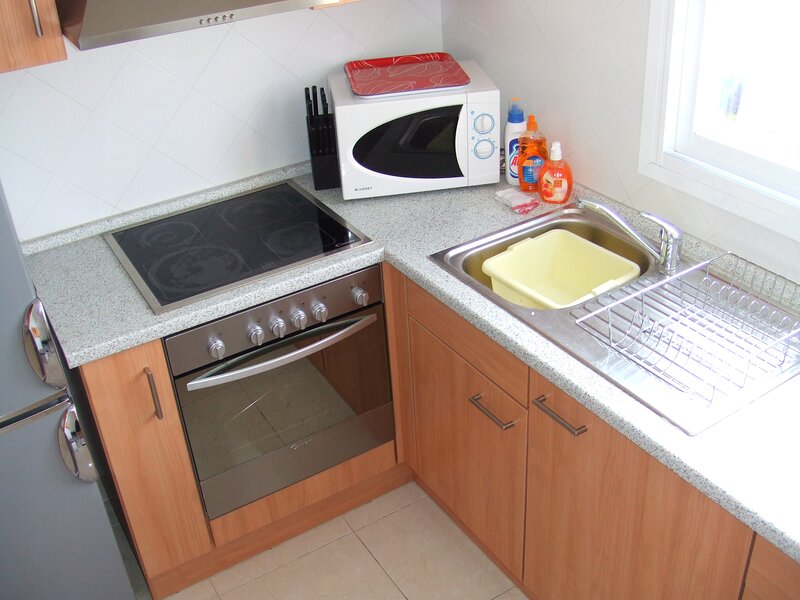
The height and width of the screenshot is (600, 800). What are the coordinates of `oven knob 3` in the screenshot? It's located at (281, 327).